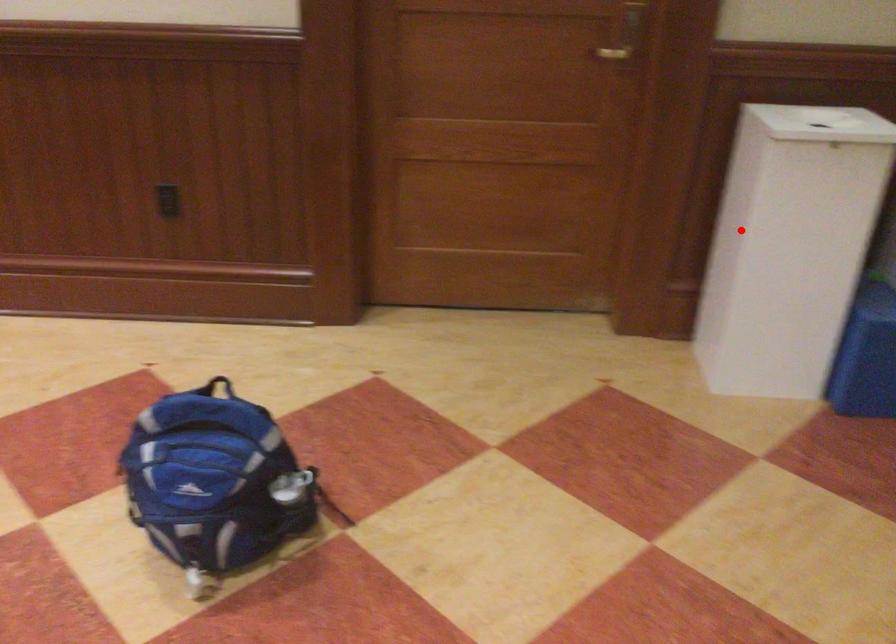
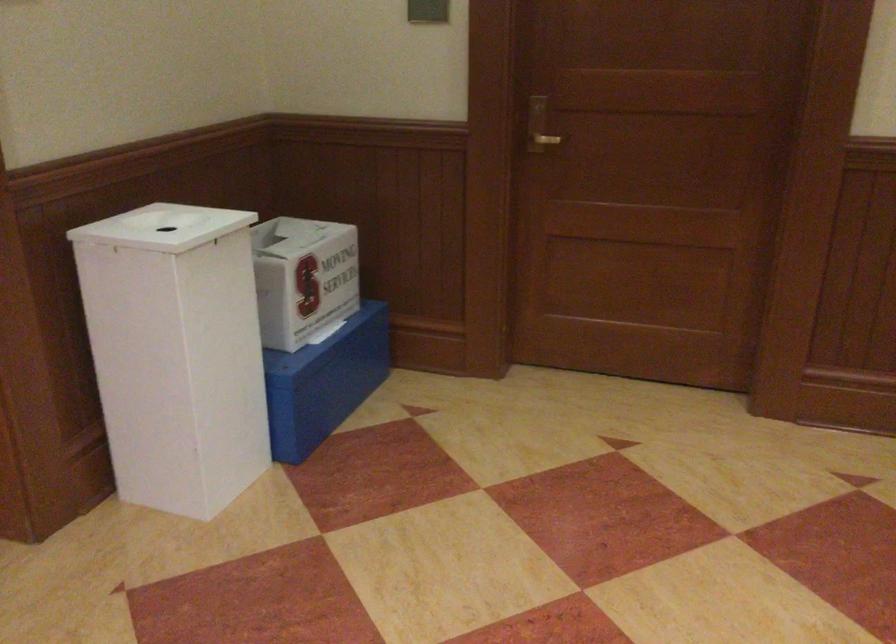
Where in the second image is the point corresponding to the highlighted location from the first image?

(176, 353)